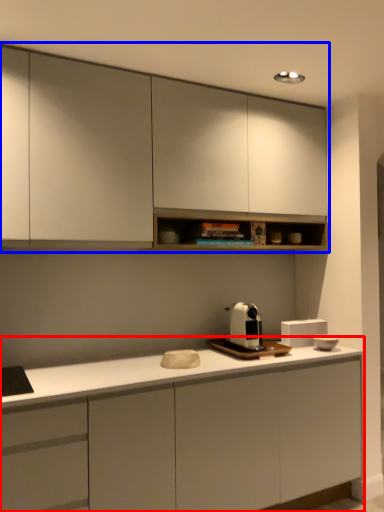
Question: Which object is closer to the camera taking this photo, cabinetry (highlighted by a red box) or cabinetry (highlighted by a blue box)?

Choices:
 (A) cabinetry
 (B) cabinetry

Answer: (A)